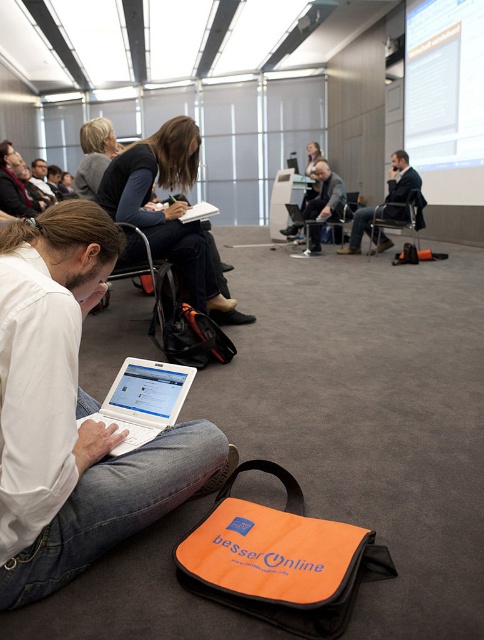
Question: Which point appears farthest from the camera in this image?

Choices:
 (A) (85, 157)
 (B) (133, 381)
 (C) (43, 166)
 (D) (2, 196)

Answer: (C)

Question: Can you confirm if matte black jacket at upper left is positioned below metallic silver chair at center?

Choices:
 (A) no
 (B) yes

Answer: (A)

Question: Which point is closer to the camera?

Choices:
 (A) matte black hair at upper left
 (B) matte black jacket at center
 (C) orange fabric chair at center

Answer: (B)

Question: Which point is closer to the camera taking this photo?

Choices:
 (A) (321, 211)
 (B) (27, 531)
 (C) (15, 189)

Answer: (B)

Question: Does matte black laptop at center appear over metallic silver chair at center?

Choices:
 (A) no
 (B) yes

Answer: (B)

Question: Does white matte laptop at lower left appear on the left side of matte black laptop at left?

Choices:
 (A) no
 (B) yes

Answer: (A)